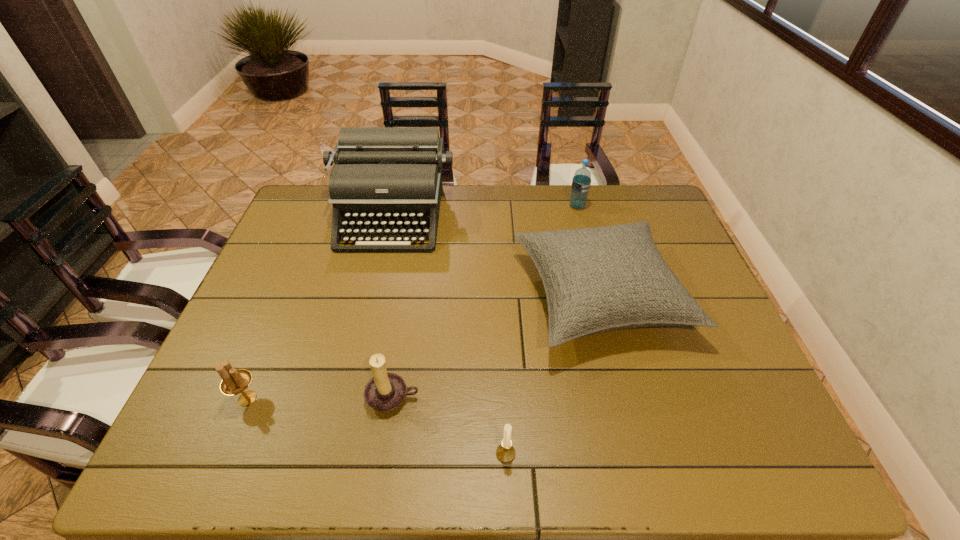
Locate an element on the screen. This screenshot has height=540, width=960. typewriter is located at coordinates (386, 180).

At what (x,y) coordinates should I click in order to perform the action: click on water bottle. Please return your answer as a coordinate pair (x, y). This screenshot has width=960, height=540. Looking at the image, I should click on 581,182.

Find the location of a particular element. The width and height of the screenshot is (960, 540). cushion is located at coordinates (598, 279).

I want to click on the second candle holder from right to left, so click(x=385, y=391).

The width and height of the screenshot is (960, 540). What are the coordinates of `the leftmost candle holder` in the screenshot? It's located at (234, 381).

Where is `the fourth object from left to right`? This screenshot has height=540, width=960. the fourth object from left to right is located at coordinates (505, 452).

Identify the location of the shortest candle holder. (505, 452).

Identify the location of free location located on the typing side of the tallest object. (377, 276).

Image resolution: width=960 pixels, height=540 pixels. Find the location of `blank space located on the front of the water bottle`. blank space located on the front of the water bottle is located at coordinates (600, 293).

The image size is (960, 540). I want to click on vacant position located on the front of the cushion, so click(623, 391).